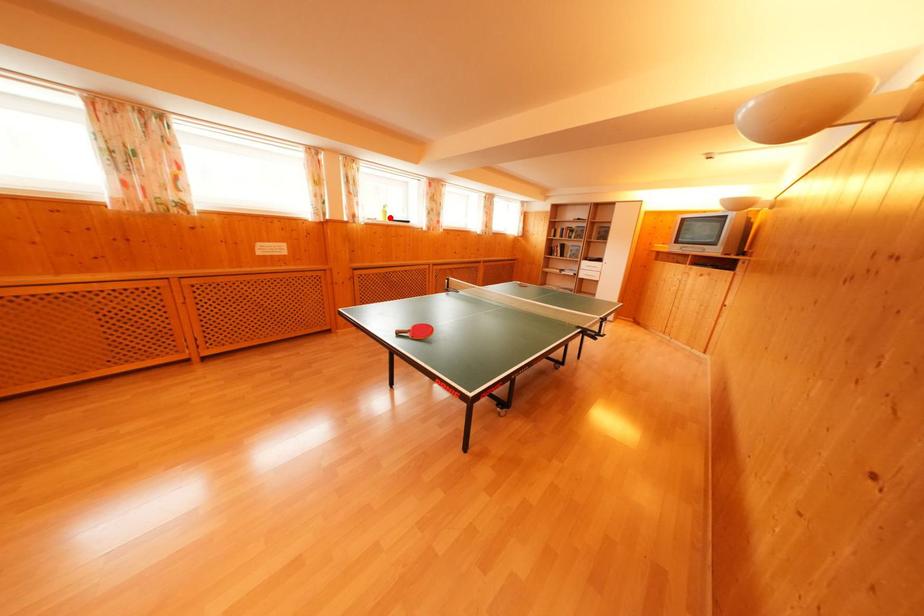
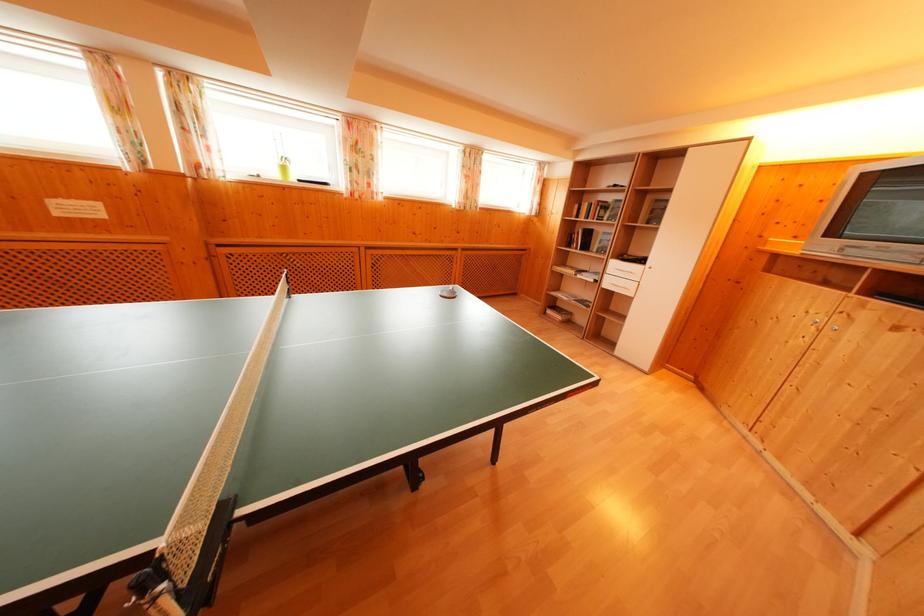
Where in the second image is the point corresponding to the highlighted location from the first image?

(288, 174)